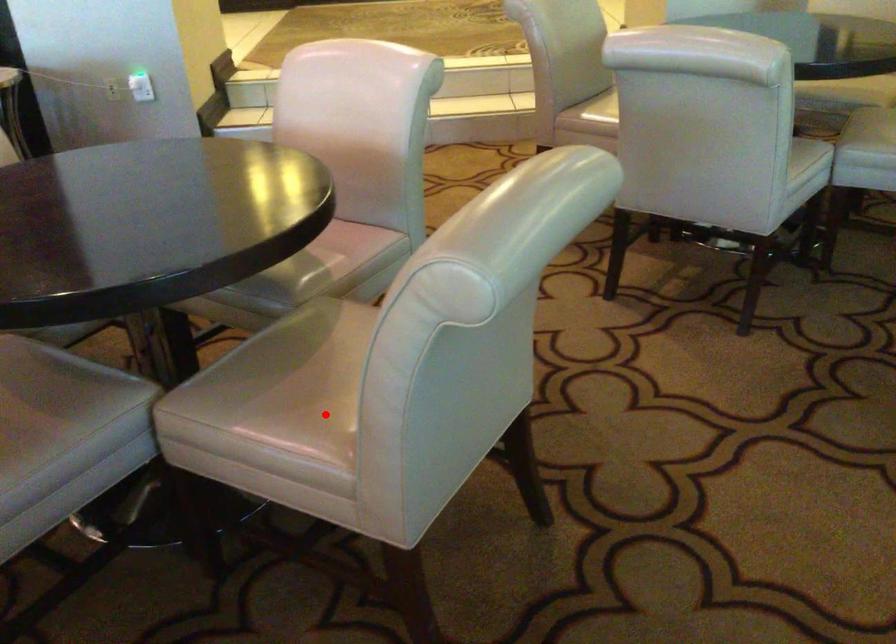
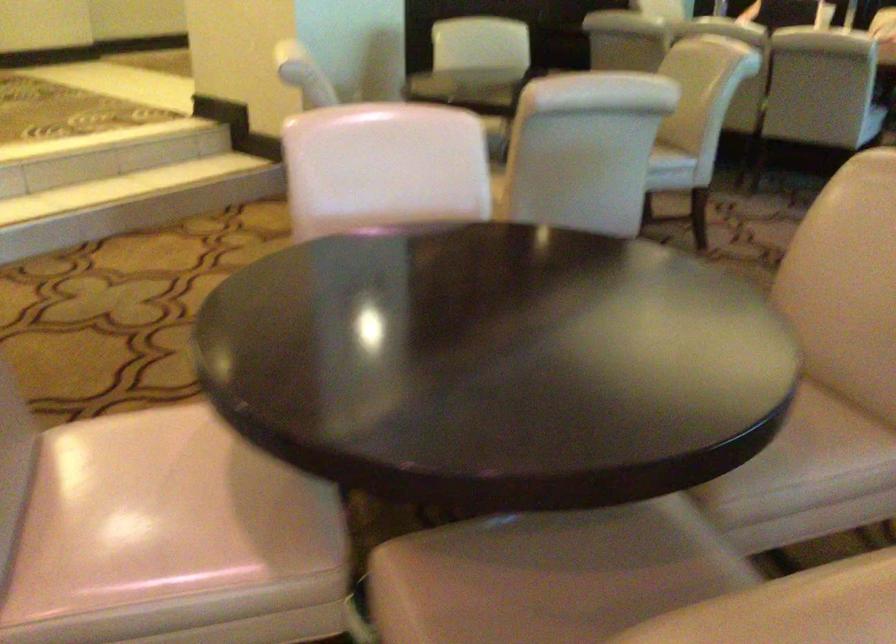
Locate, in the second image, the point that corresponds to the highlighted location in the first image.

(814, 424)